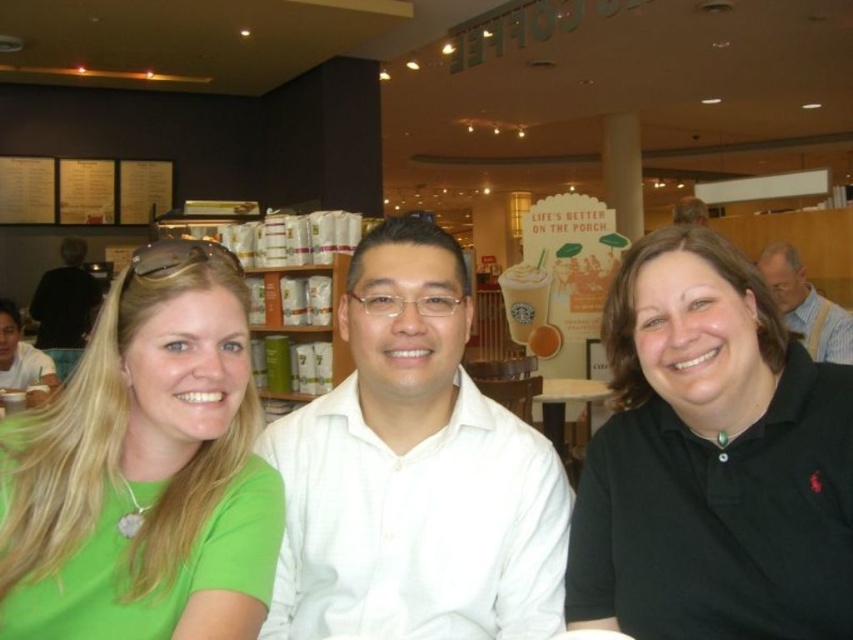
Question: Which of the following is the closest to the observer?

Choices:
 (A) (775, 250)
 (B) (732, 470)
 (C) (525, 600)

Answer: (B)

Question: Among these objects, which one is nearest to the camera?

Choices:
 (A) matte white shirt at center
 (B) white shirt at center
 (C) black polo shirt at center
 (D) black shirt at left

Answer: (C)

Question: Is green matte shirt at left below black shirt at left?

Choices:
 (A) no
 (B) yes

Answer: (B)

Question: Which of the following is the farthest from the observer?

Choices:
 (A) white shirt at center
 (B) white glossy table at center
 (C) green matte shirt at left
 (D) white smooth shirt at center

Answer: (B)

Question: In this image, where is black polo shirt at center located relative to green matte shirt at left?

Choices:
 (A) above
 (B) below

Answer: (B)

Question: Is white glossy table at center wider than matte white shirt at center?

Choices:
 (A) no
 (B) yes

Answer: (B)